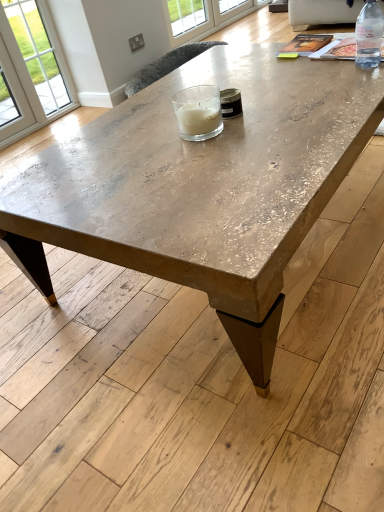
Locate an element on the screen. vacant space in front of clear glass candle at center is located at coordinates (221, 158).